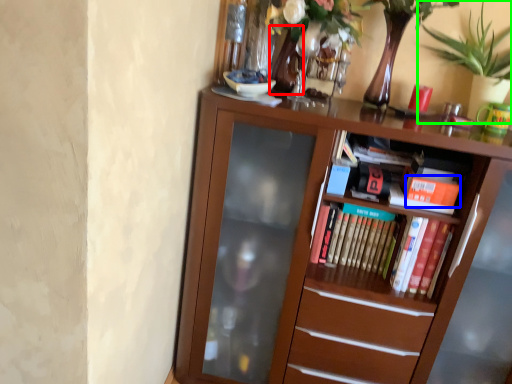
Question: Which object is positioned farthest from vase (highlighted by a red box)? Select from paperback book (highlighted by a blue box) and houseplant (highlighted by a green box).

Choices:
 (A) paperback book
 (B) houseplant

Answer: (A)